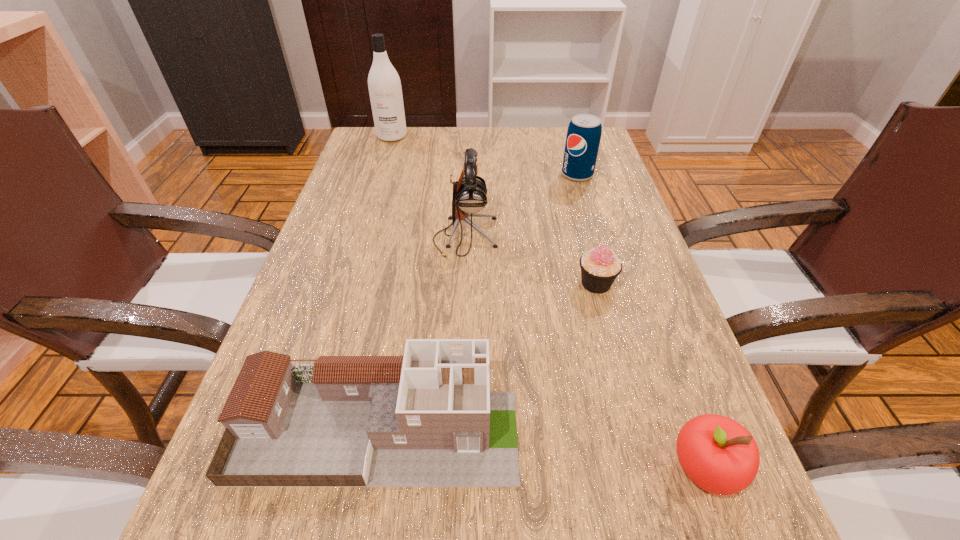
At what (x,y) coordinates should I click in order to perform the action: click on free space that satisfies the following two spatial constraints: 1. on the front side of the third farthest object; 2. on the right side of the apple. Please return your answer as a coordinate pair (x, y). The image size is (960, 540). Looking at the image, I should click on (456, 469).

Identify the location of vacant position in the image that satisfies the following two spatial constraints: 1. on the front-facing side of the shortest object; 2. on the right side of the shampoo. This screenshot has height=540, width=960. (347, 284).